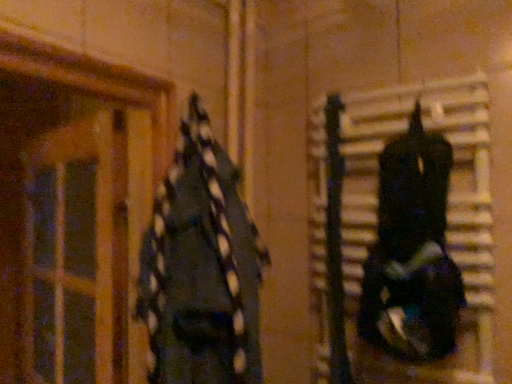
The width and height of the screenshot is (512, 384). What do you see at coordinates (70, 254) in the screenshot?
I see `translucent wooden door at left` at bounding box center [70, 254].

In order to face shiny black helmet at right, marked as the 1th clothing in a right-to-left arrangement, should I rotate leftwards or rightwards?

You should rotate right by 19.390 degrees.

The width and height of the screenshot is (512, 384). What are the coordinates of `dark blue fabric at left, marked as the 1th clothing in a left-to-right arrangement` in the screenshot? It's located at (201, 268).

Does translucent wooden door at left have a greater height compared to dark blue fabric at left, which is the 2th clothing in right-to-left order?

Yes.

Is translucent wooden door at left positioned with its back to dark blue fabric at left, marked as the 1th clothing in a left-to-right arrangement?

That's not correct — translucent wooden door at left is not looking away from dark blue fabric at left, marked as the 1th clothing in a left-to-right arrangement.

Considering the positions of objects translucent wooden door at left and dark blue fabric at left, which is the 2th clothing in right-to-left order, in the image provided, who is more to the left, translucent wooden door at left or dark blue fabric at left, which is the 2th clothing in right-to-left order,?

translucent wooden door at left is more to the left.

Is translucent wooden door at left beside dark blue fabric at left, marked as the 1th clothing in a left-to-right arrangement?

There is a gap between translucent wooden door at left and dark blue fabric at left, marked as the 1th clothing in a left-to-right arrangement.

Consider the image. Can translucent wooden door at left be found inside shiny black helmet at right, the second clothing positioned from the left?

No, translucent wooden door at left is not surrounded by shiny black helmet at right, the second clothing positioned from the left.

How different are the orientations of shiny black helmet at right, marked as the 1th clothing in a right-to-left arrangement, and translucent wooden door at left in degrees?

The angle between the facing direction of shiny black helmet at right, marked as the 1th clothing in a right-to-left arrangement, and the facing direction of translucent wooden door at left is 12.8 degrees.

Based on their sizes in the image, would you say shiny black helmet at right, marked as the 1th clothing in a right-to-left arrangement, is bigger or smaller than translucent wooden door at left?

Considering their sizes, shiny black helmet at right, marked as the 1th clothing in a right-to-left arrangement, takes up less space than translucent wooden door at left.

Looking at this image, what's the angular difference between dark blue fabric at left, marked as the 1th clothing in a left-to-right arrangement, and shiny black helmet at right, the second clothing positioned from the left,'s facing directions?

dark blue fabric at left, marked as the 1th clothing in a left-to-right arrangement, and shiny black helmet at right, the second clothing positioned from the left, are facing 79.5 degrees away from each other.

Is dark blue fabric at left, marked as the 1th clothing in a left-to-right arrangement, in contact with shiny black helmet at right, the second clothing positioned from the left?

dark blue fabric at left, marked as the 1th clothing in a left-to-right arrangement, and shiny black helmet at right, the second clothing positioned from the left, are clearly separated.

Is point (256, 301) less distant than point (435, 180)?

No, (256, 301) is behind (435, 180).

Is dark blue fabric at left, marked as the 1th clothing in a left-to-right arrangement, wider or thinner than shiny black helmet at right, marked as the 1th clothing in a right-to-left arrangement?

In the image, dark blue fabric at left, marked as the 1th clothing in a left-to-right arrangement, appears to be wider than shiny black helmet at right, marked as the 1th clothing in a right-to-left arrangement.

Considering their positions, is translucent wooden door at left located in front of or behind shiny black helmet at right, the second clothing positioned from the left?

translucent wooden door at left is behind shiny black helmet at right, the second clothing positioned from the left.

This screenshot has height=384, width=512. I want to click on glass door below the shiny black helmet at right, the second clothing positioned from the left (from a real-world perspective), so click(x=70, y=254).

Do you think translucent wooden door at left is within shiny black helmet at right, marked as the 1th clothing in a right-to-left arrangement, or outside of it?

translucent wooden door at left is not inside shiny black helmet at right, marked as the 1th clothing in a right-to-left arrangement, it's outside.

How distant is translucent wooden door at left from shiny black helmet at right, the second clothing positioned from the left?

translucent wooden door at left is 75.44 centimeters from shiny black helmet at right, the second clothing positioned from the left.

What's the angular difference between shiny black helmet at right, the second clothing positioned from the left, and dark blue fabric at left, which is the 2th clothing in right-to-left order,'s facing directions?

The angular difference between shiny black helmet at right, the second clothing positioned from the left, and dark blue fabric at left, which is the 2th clothing in right-to-left order, is 79.5 degrees.

Does point (436, 229) come farther from viewer compared to point (255, 355)?

No, (436, 229) is in front of (255, 355).

Between shiny black helmet at right, the second clothing positioned from the left, and dark blue fabric at left, marked as the 1th clothing in a left-to-right arrangement, which one has larger width?

dark blue fabric at left, marked as the 1th clothing in a left-to-right arrangement.

What are the coordinates of `clothing behind the dark blue fabric at left, marked as the 1th clothing in a left-to-right arrangement` in the screenshot? It's located at (412, 252).

Which is nearer, (194, 348) or (54, 246)?

The point (194, 348) is closer.

In the image, is dark blue fabric at left, which is the 2th clothing in right-to-left order, positioned in front of or behind translucent wooden door at left?

dark blue fabric at left, which is the 2th clothing in right-to-left order, is in front of translucent wooden door at left.

Is dark blue fabric at left, which is the 2th clothing in right-to-left order, spatially inside translucent wooden door at left, or outside of it?

dark blue fabric at left, which is the 2th clothing in right-to-left order, exists outside the volume of translucent wooden door at left.

Can you confirm if dark blue fabric at left, which is the 2th clothing in right-to-left order, is bigger than translucent wooden door at left?

Actually, dark blue fabric at left, which is the 2th clothing in right-to-left order, might be smaller than translucent wooden door at left.

Find the location of `clothing that is the 2nd one when counting forward from the translucent wooden door at left`. clothing that is the 2nd one when counting forward from the translucent wooden door at left is located at coordinates (201, 268).

Find the location of `clothing that is the 2nd one when counting rightward from the translucent wooden door at left`. clothing that is the 2nd one when counting rightward from the translucent wooden door at left is located at coordinates (412, 252).

Consider the image. Which object lies nearer to the anchor point dark blue fabric at left, marked as the 1th clothing in a left-to-right arrangement, translucent wooden door at left or shiny black helmet at right, the second clothing positioned from the left?

translucent wooden door at left lies closer to dark blue fabric at left, marked as the 1th clothing in a left-to-right arrangement, than the other object.

Considering their positions, is shiny black helmet at right, marked as the 1th clothing in a right-to-left arrangement, positioned further to translucent wooden door at left than dark blue fabric at left, marked as the 1th clothing in a left-to-right arrangement?

Among the two, shiny black helmet at right, marked as the 1th clothing in a right-to-left arrangement, is located further to translucent wooden door at left.

Considering their positions, is translucent wooden door at left positioned further to shiny black helmet at right, the second clothing positioned from the left, than dark blue fabric at left, which is the 2th clothing in right-to-left order?

The object further to shiny black helmet at right, the second clothing positioned from the left, is translucent wooden door at left.

Based on their spatial positions, is dark blue fabric at left, which is the 2th clothing in right-to-left order, or shiny black helmet at right, marked as the 1th clothing in a right-to-left arrangement, closer to translucent wooden door at left?

dark blue fabric at left, which is the 2th clothing in right-to-left order, is closer to translucent wooden door at left.

When comparing their distances from shiny black helmet at right, the second clothing positioned from the left, does dark blue fabric at left, which is the 2th clothing in right-to-left order, or translucent wooden door at left seem closer?

dark blue fabric at left, which is the 2th clothing in right-to-left order, is positioned closer to the anchor shiny black helmet at right, the second clothing positioned from the left.

Based on their spatial positions, is shiny black helmet at right, marked as the 1th clothing in a right-to-left arrangement, or translucent wooden door at left further from dark blue fabric at left, which is the 2th clothing in right-to-left order?

shiny black helmet at right, marked as the 1th clothing in a right-to-left arrangement, is further to dark blue fabric at left, which is the 2th clothing in right-to-left order.

Find the location of a particular element. clothing between translucent wooden door at left and shiny black helmet at right, marked as the 1th clothing in a right-to-left arrangement, from left to right is located at coordinates pyautogui.click(x=201, y=268).